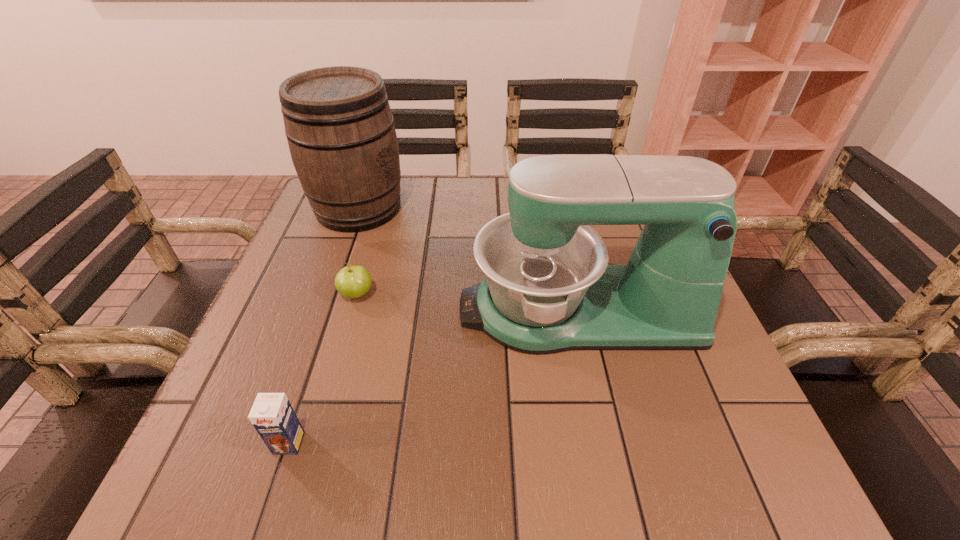
Locate an element on the screen. the farthest object is located at coordinates point(341,135).

In order to click on mixer in this screenshot , I will do `click(548, 288)`.

Locate an element on the screen. Image resolution: width=960 pixels, height=540 pixels. the nearest object is located at coordinates (272, 415).

In order to click on the third tallest object in this screenshot , I will do [x=272, y=415].

Locate an element on the screen. The width and height of the screenshot is (960, 540). apple is located at coordinates (353, 281).

The width and height of the screenshot is (960, 540). In order to click on free space located 0.260m on the front of the farthest object in this screenshot , I will do `click(320, 319)`.

I want to click on vacant space located on the front-facing side of the rightmost object, so click(389, 310).

The width and height of the screenshot is (960, 540). Find the location of `vacant region located on the front-facing side of the rightmost object`. vacant region located on the front-facing side of the rightmost object is located at coordinates (409, 310).

Find the location of a particular element. This screenshot has height=540, width=960. free point located on the front-facing side of the rightmost object is located at coordinates (324, 310).

The height and width of the screenshot is (540, 960). I want to click on free space located 0.130m on the left of the apple, so click(x=276, y=294).